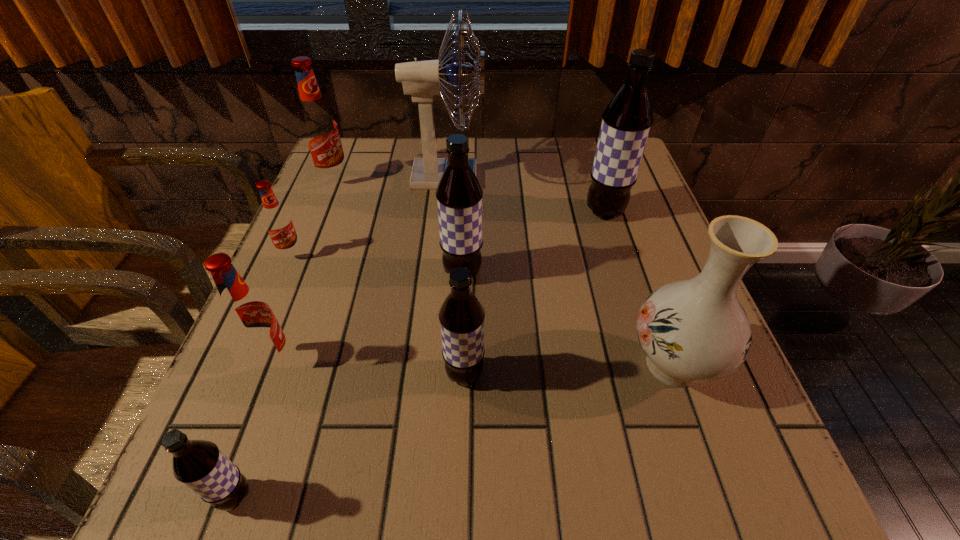
Locate an element on the screen. This screenshot has height=540, width=960. the nearest root beer is located at coordinates (199, 464).

Locate an element on the screen. This screenshot has height=540, width=960. the smallest brown root beer is located at coordinates (199, 464).

Find the location of a particular element. vacant space situated on the front-facing side of the blue fan is located at coordinates (591, 178).

I want to click on free space located 0.090m on the front of the tallest root beer, so click(x=617, y=252).

At what (x,y) coordinates should I click in order to perform the action: click on vacant space situated on the right of the biggest red root beer. Please return your answer as a coordinate pair (x, y). The width and height of the screenshot is (960, 540). Looking at the image, I should click on (496, 179).

Identify the location of free spot located 0.270m on the front of the second biggest brown root beer. The width and height of the screenshot is (960, 540). (457, 415).

Image resolution: width=960 pixels, height=540 pixels. In order to click on vacant space located on the left of the vase in this screenshot , I will do `click(501, 364)`.

The image size is (960, 540). Find the location of `free location located on the right of the second smallest red root beer`. free location located on the right of the second smallest red root beer is located at coordinates (381, 361).

You are a GUI agent. You are given a task and a screenshot of the screen. Output one action in this format:
    pyautogui.click(x=<x>, y=<y>)
    Task: Click on the vacant space located on the back of the second nearest brown root beer
    This screenshot has width=960, height=540.
    Given the screenshot: What is the action you would take?
    pyautogui.click(x=467, y=308)

In order to click on free space located 0.360m on the right of the smallest red root beer in this screenshot , I will do `click(471, 254)`.